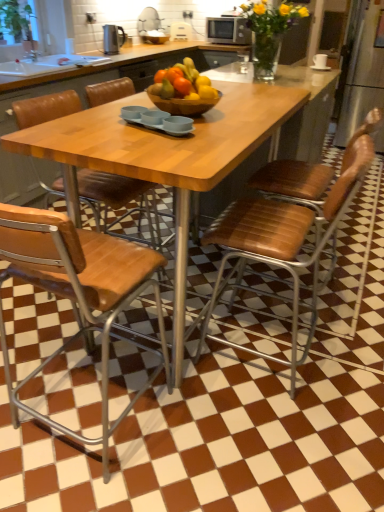
The height and width of the screenshot is (512, 384). Identify the location of vacant point to the right of wooden at center, marked as the second chair in a left-to-right arrangement. (245, 439).